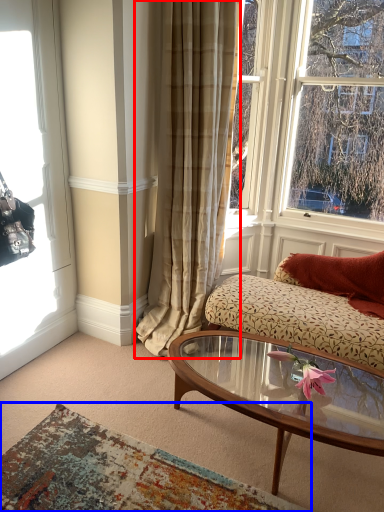
Question: Which point is further to the camera, curtain (highlighted by a red box) or plain (highlighted by a blue box)?

Choices:
 (A) curtain
 (B) plain

Answer: (A)